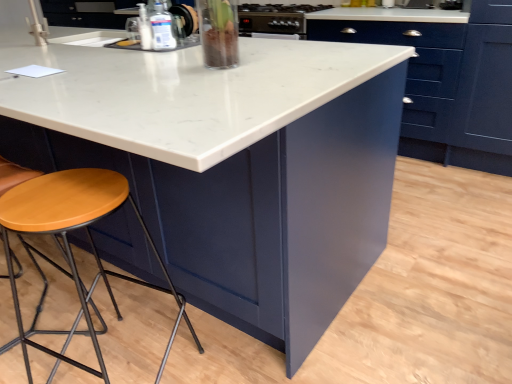
What are the coordinates of `free point to the right of wooden seat stool at lower left` in the screenshot? It's located at (225, 350).